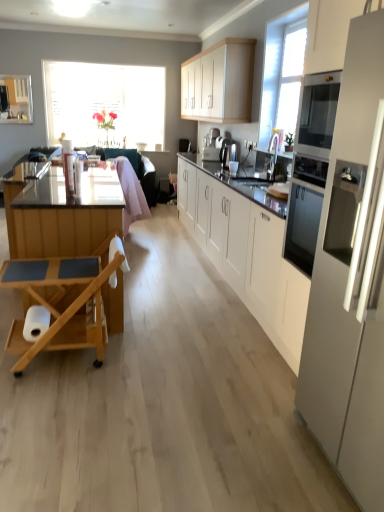
Question: Is white glossy refrigerator at right to the left of white glossy sink at center from the viewer's perspective?

Choices:
 (A) yes
 (B) no

Answer: (B)

Question: Is white glossy refrigerator at right bigger than white glossy sink at center?

Choices:
 (A) yes
 (B) no

Answer: (A)

Question: Does white glossy refrigerator at right have a lesser height compared to white glossy sink at center?

Choices:
 (A) no
 (B) yes

Answer: (A)

Question: Is white glossy refrigerator at right looking in the opposite direction of white glossy sink at center?

Choices:
 (A) yes
 (B) no

Answer: (B)

Question: Is white glossy refrigerator at right taller than white glossy sink at center?

Choices:
 (A) yes
 (B) no

Answer: (A)

Question: From the image's perspective, is white matte cabinet at upper center, which is the 2th cabinetry from bottom to top, above or below white glossy refrigerator at right?

Choices:
 (A) above
 (B) below

Answer: (A)

Question: Is white matte cabinet at upper center, which is the 2th cabinetry from bottom to top, to the left or to the right of white glossy refrigerator at right in the image?

Choices:
 (A) right
 (B) left

Answer: (B)

Question: Is point (230, 113) positioned closer to the camera than point (336, 301)?

Choices:
 (A) closer
 (B) farther

Answer: (B)

Question: From a real-world perspective, is white matte cabinet at upper center, which is the 2th cabinetry from bottom to top, above or below white glossy refrigerator at right?

Choices:
 (A) above
 (B) below

Answer: (A)

Question: Is pink fabric swivel chair at center taller or shorter than white glossy sink at center?

Choices:
 (A) short
 (B) tall

Answer: (B)

Question: From the image's perspective, is pink fabric swivel chair at center positioned above or below white glossy sink at center?

Choices:
 (A) above
 (B) below

Answer: (B)

Question: Looking at their shapes, would you say pink fabric swivel chair at center is wider or thinner than white glossy sink at center?

Choices:
 (A) thin
 (B) wide

Answer: (B)

Question: Would you say pink fabric swivel chair at center is inside or outside white glossy sink at center?

Choices:
 (A) outside
 (B) inside

Answer: (A)

Question: Is translucent glass window at upper left in front of or behind white matte cabinet at center, placed as the first cabinetry when sorted from bottom to top, in the image?

Choices:
 (A) front
 (B) behind

Answer: (B)

Question: Considering the relative positions of translucent glass window at upper left and white matte cabinet at center, placed as the first cabinetry when sorted from bottom to top, in the image provided, is translucent glass window at upper left to the left or to the right of white matte cabinet at center, placed as the first cabinetry when sorted from bottom to top,?

Choices:
 (A) left
 (B) right

Answer: (A)